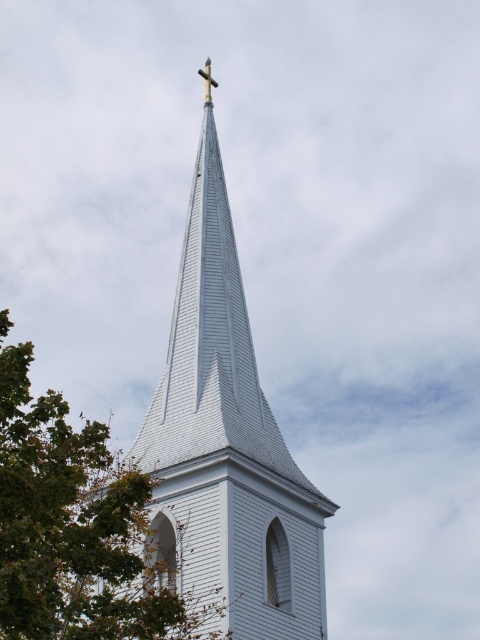
Consider the image. You are an artist sketching the church scene. You need to decide which object to draw first based on their sizes. Which one should you start with, the green leafy tree at upper left or the gold metallic cross at upper center?

The green leafy tree at upper left is larger in size than the gold metallic cross at upper center, so you should start by drawing the green leafy tree at upper left first.

You are an architect analyzing the church steeple. You observe the green leafy tree at upper left and the gold metallic cross at upper center. Which object is located to the left of the other?

The green leafy tree at upper left is positioned on the left side of gold metallic cross at upper center.